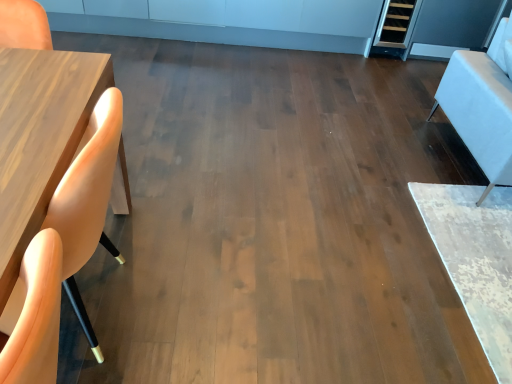
Question: Is white leather armchair at right at the left side of matte wood chair at left?

Choices:
 (A) no
 (B) yes

Answer: (A)

Question: Considering the relative sizes of white leather armchair at right and matte wood chair at left in the image provided, is white leather armchair at right bigger than matte wood chair at left?

Choices:
 (A) yes
 (B) no

Answer: (A)

Question: Is white leather armchair at right outside of matte wood chair at left?

Choices:
 (A) no
 (B) yes

Answer: (B)

Question: From a real-world perspective, is white leather armchair at right positioned under matte wood chair at left based on gravity?

Choices:
 (A) yes
 (B) no

Answer: (B)

Question: Is matte wood chair at left at the back of white leather armchair at right?

Choices:
 (A) no
 (B) yes

Answer: (A)

Question: Is the surface of white leather armchair at right in direct contact with matte wood chair at left?

Choices:
 (A) no
 (B) yes

Answer: (A)

Question: From a real-world perspective, is matte wood chair at left positioned under white leather armchair at right based on gravity?

Choices:
 (A) no
 (B) yes

Answer: (B)

Question: From the image's perspective, is matte wood chair at left on white leather armchair at right?

Choices:
 (A) no
 (B) yes

Answer: (A)

Question: Is matte wood chair at left at the left side of white leather armchair at right?

Choices:
 (A) yes
 (B) no

Answer: (A)

Question: From the image's perspective, would you say matte wood chair at left is shown under white leather armchair at right?

Choices:
 (A) yes
 (B) no

Answer: (A)

Question: Considering the relative sizes of matte wood chair at left and white leather armchair at right in the image provided, is matte wood chair at left taller than white leather armchair at right?

Choices:
 (A) no
 (B) yes

Answer: (A)

Question: Is matte wood chair at left to the right of white leather armchair at right from the viewer's perspective?

Choices:
 (A) yes
 (B) no

Answer: (B)

Question: From a real-world perspective, is white leather armchair at right positioned above or below matte wood chair at left?

Choices:
 (A) below
 (B) above

Answer: (B)